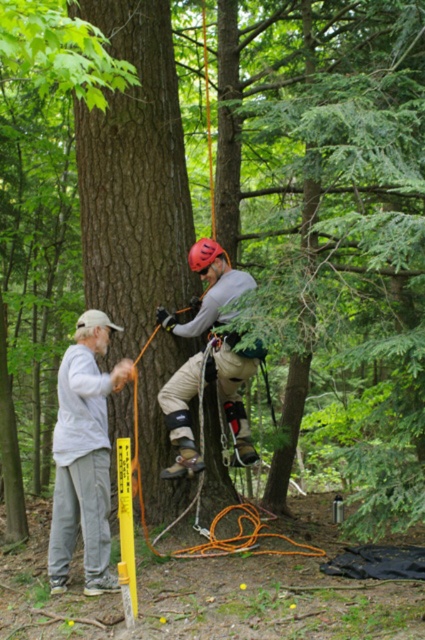
Between tan fabric harness at center and rubber/matte helmet at center, which one is positioned higher?

Positioned higher is rubber/matte helmet at center.

Can you confirm if tan fabric harness at center is smaller than rubber/matte helmet at center?

Incorrect, tan fabric harness at center is not smaller in size than rubber/matte helmet at center.

Identify the location of tan fabric harness at center. (209, 289).

Can you confirm if gray cotton shirt at left is positioned above rubber/matte helmet at center?

Actually, gray cotton shirt at left is below rubber/matte helmet at center.

Between gray cotton shirt at left and rubber/matte helmet at center, which one has less height?

rubber/matte helmet at center

Does point (65, 512) come behind point (201, 241)?

No, it is in front of (201, 241).

You are a GUI agent. You are given a task and a screenshot of the screen. Output one action in this format:
    pyautogui.click(x=<x>, y=<y>)
    Task: Click on the gray cotton shirt at left
    The height and width of the screenshot is (640, 425).
    Given the screenshot: What is the action you would take?
    pyautogui.click(x=84, y=456)

Does gray cotton shirt at left appear over tan fabric harness at center?

No, gray cotton shirt at left is not above tan fabric harness at center.

Is gray cotton shirt at left further to the viewer compared to tan fabric harness at center?

No, it is in front of tan fabric harness at center.

Does point (84, 524) lie in front of point (184, 460)?

Yes, it is.

Identify the location of gray cotton shirt at left. The width and height of the screenshot is (425, 640). (84, 456).